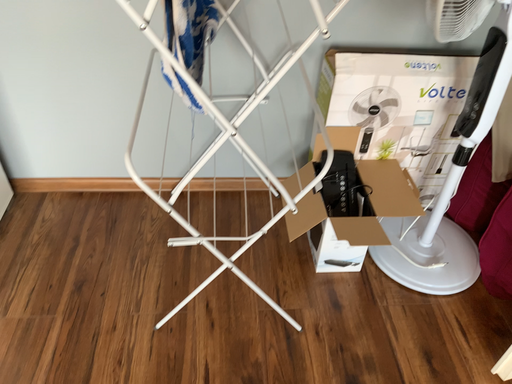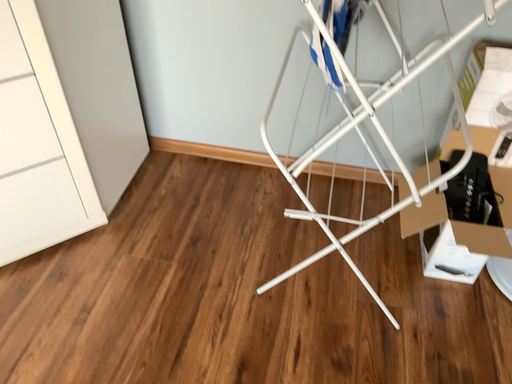
Question: Which way did the camera rotate in the video?

Choices:
 (A) rotated left
 (B) rotated right

Answer: (A)